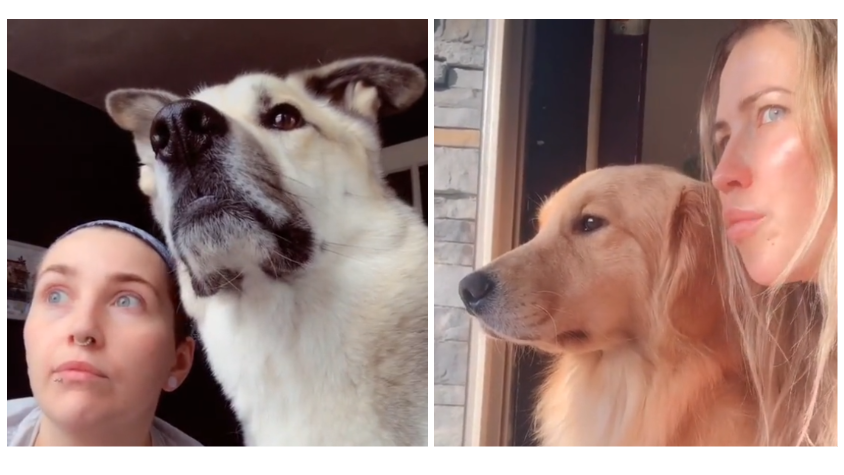
The height and width of the screenshot is (475, 844). In order to click on painting in this screenshot , I will do `click(20, 270)`.